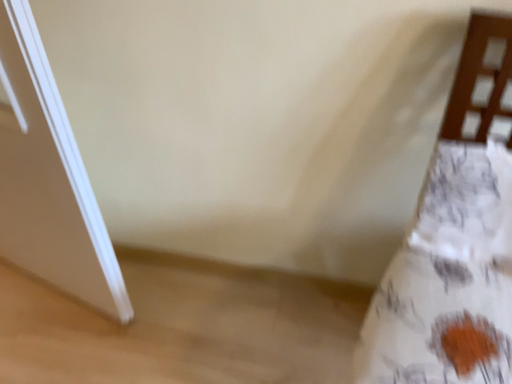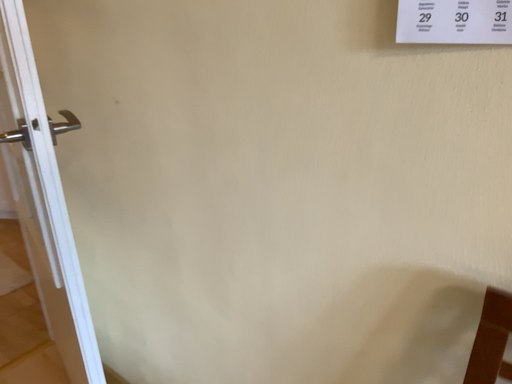
Question: Which way did the camera rotate in the video?

Choices:
 (A) rotated left
 (B) rotated right

Answer: (A)